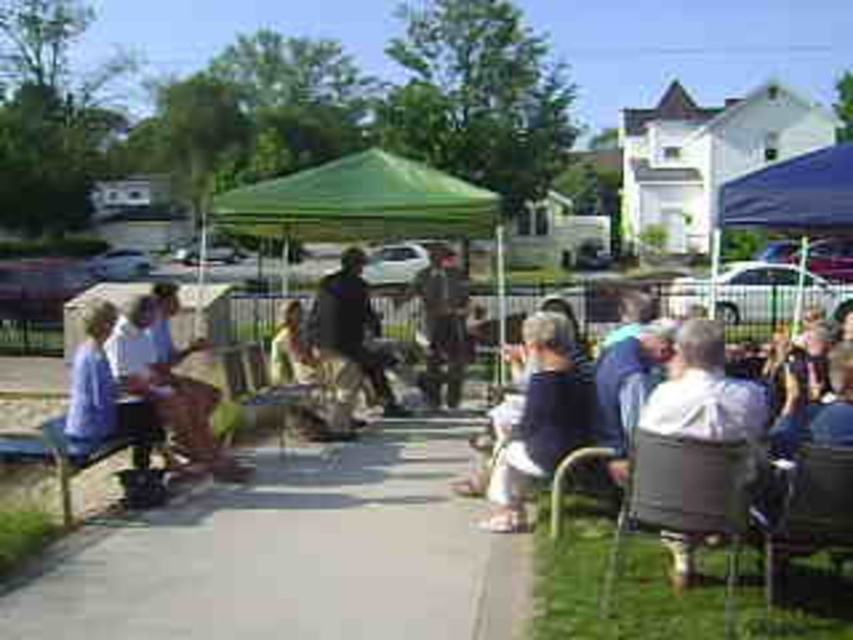
You are at the outdoor gathering and want to find a shaded area. You see the green fabric canopy at center and the dark brown leather jacket at center. Which one is closer to the left side of the scene?

The green fabric canopy at center is to the left of dark brown leather jacket at center, so the green fabric canopy at center is closer to the left side of the scene.

You are planning to place a new bench along the gray concrete pavement at center. Considering the wooden chair at center is already there, which object has a greater width to accommodate more people?

The gray concrete pavement at center is wider than the wooden chair at center, so placing the bench there would allow more people to sit comfortably.